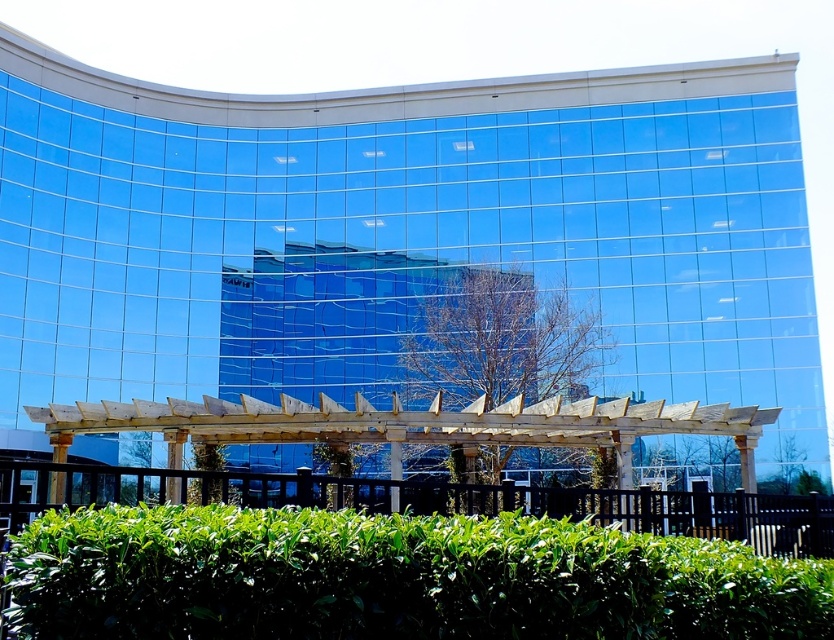
Is point (431, 531) positioned behind point (496, 316)?

That is False.

This screenshot has height=640, width=834. I want to click on green leafy hedge at lower center, so click(x=394, y=579).

Does point (23, 618) come closer to viewer compared to point (510, 346)?

Yes, point (23, 618) is in front of point (510, 346).

Find the location of a particular element. green leafy hedge at lower center is located at coordinates (394, 579).